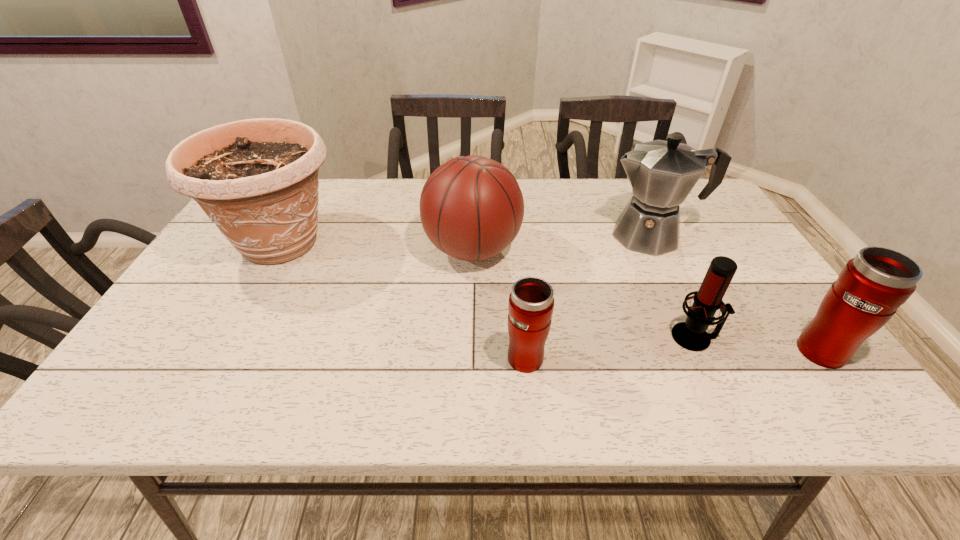
At what (x,y) coordinates should I click in order to perform the action: click on flowerpot positioned at the far edge. Please return your answer as a coordinate pair (x, y). Looking at the image, I should click on (257, 179).

Where is `microphone situated at the near edge`? The image size is (960, 540). microphone situated at the near edge is located at coordinates (691, 335).

Locate an element on the screen. The width and height of the screenshot is (960, 540). object positioned at the left edge is located at coordinates click(257, 179).

Identify the location of thermos bottle situated at the right edge. (870, 288).

Where is `coffeepot that is at the right edge`? This screenshot has width=960, height=540. coffeepot that is at the right edge is located at coordinates (662, 173).

The height and width of the screenshot is (540, 960). Find the location of `object positioned at the far left corner`. object positioned at the far left corner is located at coordinates (257, 179).

The width and height of the screenshot is (960, 540). Find the location of `object that is at the far right corner`. object that is at the far right corner is located at coordinates (662, 173).

Where is `object situated at the near right corner`? This screenshot has width=960, height=540. object situated at the near right corner is located at coordinates (870, 288).

Find the location of a particular element. blank space at the far edge of the desktop is located at coordinates (372, 186).

The height and width of the screenshot is (540, 960). I want to click on free location at the near edge, so click(309, 357).